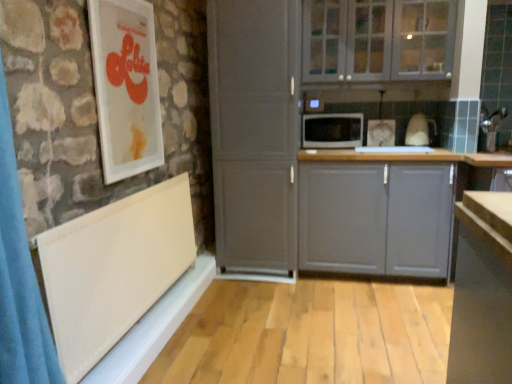
Locate an element on the screen. vacant space in between white matte cabinet at center and gray matte cabinet at center, which appears as the second cabinetry when viewed from the top is located at coordinates (350, 286).